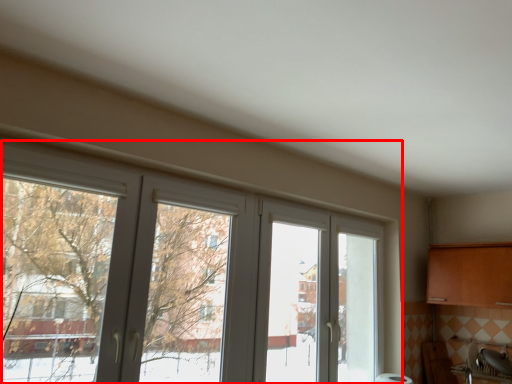
Question: Where is window (annotated by the red box) located in relation to sink in the image?

Choices:
 (A) left
 (B) right

Answer: (A)